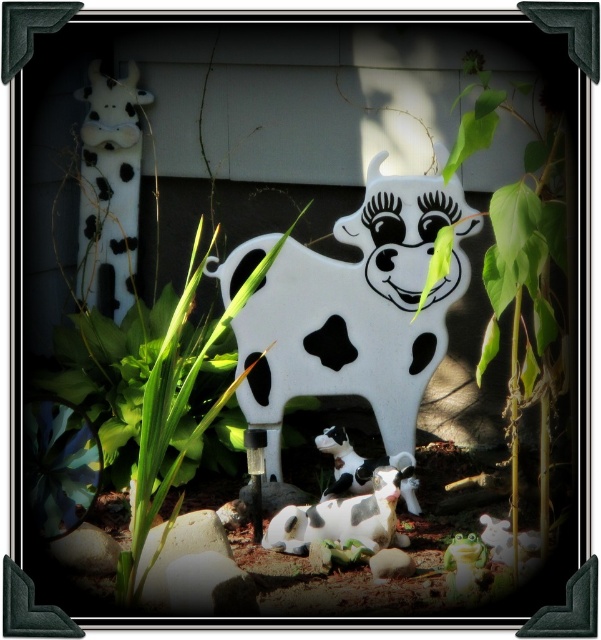
You are a gardener planning to place a new flowerpot between the green leafy plant at center and the white matte cow at lower center. Based on their widths, which object should you consider for spacing adjustments to ensure the flowerpot fits comfortably?

The green leafy plant at center might be wider than the white matte cow at lower center, so you should consider the width of the green leafy plant at center when placing the flowerpot to ensure there is enough space.

You are standing at the viewpoint of the image and want to place a new decoration between the two points, point (163,480) and point (352,474). Which point should you place it closer to so it appears in front of the other?

You should place the new decoration closer to point (163,480) because it is in front of point (352,474).